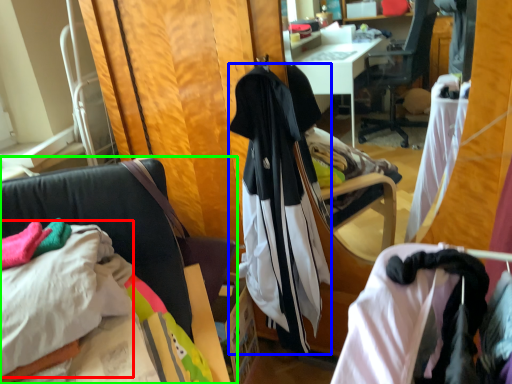
Question: Considering the real-world distances, which object is closest to sheet (highlighted by a red box)? garment (highlighted by a blue box) or chair (highlighted by a green box).

Choices:
 (A) garment
 (B) chair

Answer: (B)